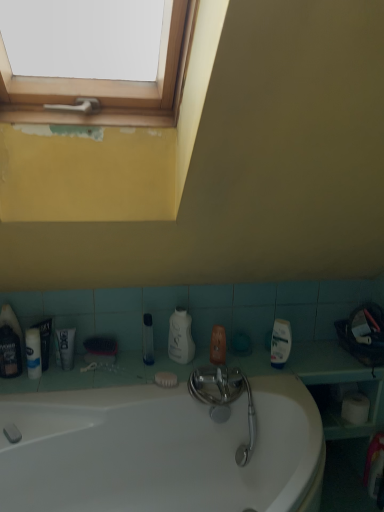
Where is `white matte soap at lower center`? white matte soap at lower center is located at coordinates (166, 379).

The height and width of the screenshot is (512, 384). Identify the location of white matte toilet paper at lower right. (355, 408).

Locate an element on the screen. The width and height of the screenshot is (384, 512). translucent plastic mouthwash at lower left, the second mouthwash viewed from the back is located at coordinates (10, 353).

Is clear plastic tube at center, the first mouthwash when ordered from right to left, facing towards white glossy bathtub at center?

No, clear plastic tube at center, the first mouthwash when ordered from right to left, is not aimed at white glossy bathtub at center.

Is clear plastic tube at center, the first mouthwash when ordered from right to left, taller or shorter than white glossy bathtub at center?

In the image, clear plastic tube at center, the first mouthwash when ordered from right to left, appears to be shorter than white glossy bathtub at center.

Is clear plastic tube at center, the 2th mouthwash in the front-to-back sequence, next to white glossy bathtub at center?

No, clear plastic tube at center, the 2th mouthwash in the front-to-back sequence, is not in contact with white glossy bathtub at center.

Which of these two, clear plastic tube at center, the 2th mouthwash in the front-to-back sequence, or white glossy bathtub at center, is wider?

white glossy bathtub at center.

Is clear plastic bottle at center, which ranks as the second cleaning product in right-to-left order, completely or partially inside white glossy bathtub at center?

Actually, clear plastic bottle at center, which ranks as the second cleaning product in right-to-left order, is outside white glossy bathtub at center.

Which is in front, white glossy bathtub at center or clear plastic bottle at center, which ranks as the second cleaning product in right-to-left order?

white glossy bathtub at center.

Is translucent plastic mouthwash at lower left, marked as the 2th mouthwash in a right-to-left arrangement, facing towards white matte tube at lower left?

No.

From the picture: How different are the orientations of translucent plastic mouthwash at lower left, the first mouthwash from the front, and white matte tube at lower left in degrees?

There is a 6.67-degree angle between the facing directions of translucent plastic mouthwash at lower left, the first mouthwash from the front, and white matte tube at lower left.

Considering the relative positions of translucent plastic mouthwash at lower left, the first mouthwash in the left-to-right sequence, and white matte tube at lower left in the image provided, is translucent plastic mouthwash at lower left, the first mouthwash in the left-to-right sequence, behind white matte tube at lower left?

No, it is not.

Which point is more forward, (0, 357) or (38, 360)?

The point (0, 357) is more forward.

Which is less distant, (x=151, y=329) or (x=349, y=400)?

Point (x=151, y=329).

Consider the image. Between clear plastic tube at center, the first mouthwash when ordered from right to left, and white matte toilet paper at lower right, which one has smaller size?

Smaller between the two is clear plastic tube at center, the first mouthwash when ordered from right to left.

The image size is (384, 512). I want to click on toilet paper that is below the clear plastic tube at center, the first mouthwash when ordered from right to left (from the image's perspective), so click(x=355, y=408).

Considering the relative sizes of clear plastic tube at center, the first mouthwash when ordered from right to left, and white matte toilet paper at lower right in the image provided, is clear plastic tube at center, the first mouthwash when ordered from right to left, shorter than white matte toilet paper at lower right?

No.

Considering the positions of objects white matte tube at lower left and clear plastic tube at center, the first mouthwash when ordered from right to left, in the image provided, who is more to the right, white matte tube at lower left or clear plastic tube at center, the first mouthwash when ordered from right to left,?

Positioned to the right is clear plastic tube at center, the first mouthwash when ordered from right to left.

Between white matte tube at lower left and clear plastic tube at center, the first mouthwash when ordered from back to front, which one has less height?

white matte tube at lower left.

How much distance is there between white matte tube at lower left and clear plastic tube at center, the first mouthwash when ordered from right to left?

A distance of 45.09 centimeters exists between white matte tube at lower left and clear plastic tube at center, the first mouthwash when ordered from right to left.

Could you tell me if white matte tube at lower left is facing clear plastic tube at center, which is the second mouthwash in left-to-right order?

No, white matte tube at lower left does not turn towards clear plastic tube at center, which is the second mouthwash in left-to-right order.

Does point (38, 172) lie in front of point (281, 338)?

Yes, it is.

From a real-world perspective, is wooden frame at upper left physically below white glossy bottle at right, the first cleaning product in the right-to-left sequence?

No.

Considering the sizes of wooden frame at upper left and white glossy bottle at right, the first cleaning product in the right-to-left sequence, in the image, is wooden frame at upper left bigger or smaller than white glossy bottle at right, the first cleaning product in the right-to-left sequence,?

wooden frame at upper left is bigger than white glossy bottle at right, the first cleaning product in the right-to-left sequence.

Considering the relative positions of wooden frame at upper left and white matte soap at lower center in the image provided, is wooden frame at upper left behind white matte soap at lower center?

That is False.

You are a GUI agent. You are given a task and a screenshot of the screen. Output one action in this format:
    pyautogui.click(x=<x>, y=<y>)
    Task: Click on the soap that appears behind the wooden frame at upper left
    This screenshot has height=512, width=384.
    Given the screenshot: What is the action you would take?
    pyautogui.click(x=166, y=379)

Is wooden frame at upper left to the left of white matte soap at lower center from the viewer's perspective?

No.

Can you confirm if wooden frame at upper left is shorter than white matte soap at lower center?

No, wooden frame at upper left is not shorter than white matte soap at lower center.

In order to click on bathtub that appears below the clear plastic tube at center, the 2th mouthwash in the front-to-back sequence (from the image's perspective) in this screenshot , I will do `click(161, 450)`.

You are a GUI agent. You are given a task and a screenshot of the screen. Output one action in this format:
    pyautogui.click(x=<x>, y=<y>)
    Task: Click on the bathtub lying in front of the clear plastic bottle at center, arranged as the 1th cleaning product when viewed from the left
    
    Given the screenshot: What is the action you would take?
    pyautogui.click(x=161, y=450)

When comparing their distances from clear plastic bottle at center, which ranks as the second cleaning product in right-to-left order, does white matte soap at lower center or wooden frame at upper left seem closer?

white matte soap at lower center lies closer to clear plastic bottle at center, which ranks as the second cleaning product in right-to-left order, than the other object.

Based on their spatial positions, is clear plastic tube at center, the first mouthwash when ordered from back to front, or clear plastic bottle at center, arranged as the 1th cleaning product when viewed from the left, closer to white matte toothpaste at lower left?

The object closer to white matte toothpaste at lower left is clear plastic tube at center, the first mouthwash when ordered from back to front.

When comparing their distances from white matte toilet paper at lower right, does white matte tube at lower left or clear plastic tube at center, the 2th mouthwash in the front-to-back sequence, seem closer?

clear plastic tube at center, the 2th mouthwash in the front-to-back sequence, is closer to white matte toilet paper at lower right.

From the image, which object appears to be farther from translucent plastic mouthwash at lower left, marked as the 2th mouthwash in a right-to-left arrangement, white glossy bottle at right, the first cleaning product in the right-to-left sequence, or white matte soap at lower center?

white glossy bottle at right, the first cleaning product in the right-to-left sequence.

From the image, which object appears to be farther from polished chrome faucet at center, white matte toilet paper at lower right or white glossy bathtub at center?

white matte toilet paper at lower right is positioned further to the anchor polished chrome faucet at center.

Considering their positions, is translucent plastic mouthwash at lower left, marked as the 2th mouthwash in a right-to-left arrangement, positioned closer to clear plastic tube at center, which is the second mouthwash in left-to-right order, than white glossy bottle at right, the first cleaning product in the right-to-left sequence?

translucent plastic mouthwash at lower left, marked as the 2th mouthwash in a right-to-left arrangement, is positioned closer to the anchor clear plastic tube at center, which is the second mouthwash in left-to-right order.

Considering their positions, is translucent plastic mouthwash at lower left, the second mouthwash viewed from the back, positioned further to white matte toilet paper at lower right than white glossy bathtub at center?

translucent plastic mouthwash at lower left, the second mouthwash viewed from the back, lies further to white matte toilet paper at lower right than the other object.

When comparing their distances from translucent plastic mouthwash at lower left, the first mouthwash from the front, does polished chrome faucet at center or clear plastic bottle at center, which ranks as the second cleaning product in right-to-left order, seem closer?

Based on the image, clear plastic bottle at center, which ranks as the second cleaning product in right-to-left order, appears to be nearer to translucent plastic mouthwash at lower left, the first mouthwash from the front.

I want to click on bathtub between clear plastic tube at center, the 2th mouthwash in the front-to-back sequence, and white matte toilet paper at lower right, so click(161, 450).

The height and width of the screenshot is (512, 384). In order to click on tap between white matte soap at lower center and white glossy bottle at right, the first cleaning product in the right-to-left sequence in this screenshot , I will do `click(225, 397)`.

I want to click on soap between translucent plastic mouthwash at lower left, the first mouthwash from the front, and clear plastic bottle at center, which ranks as the second cleaning product in right-to-left order, so click(x=166, y=379).

This screenshot has height=512, width=384. Find the location of `soap located between clear plastic tube at center, which is the second mouthwash in left-to-right order, and white matte toilet paper at lower right in the left-right direction`. soap located between clear plastic tube at center, which is the second mouthwash in left-to-right order, and white matte toilet paper at lower right in the left-right direction is located at coordinates (166, 379).